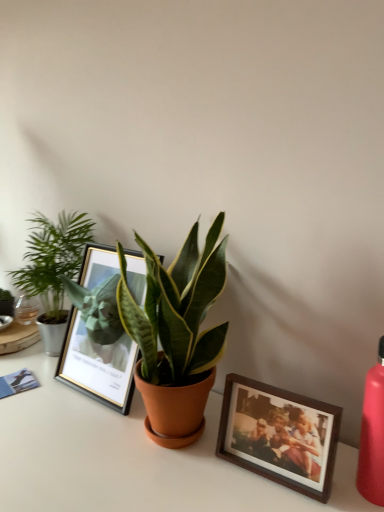
At what (x,y) coordinates should I click in order to perform the action: click on vacant area on top of white glossy table at center (from a real-world perspective). Please return your answer as a coordinate pair (x, y). Looking at the image, I should click on (97, 426).